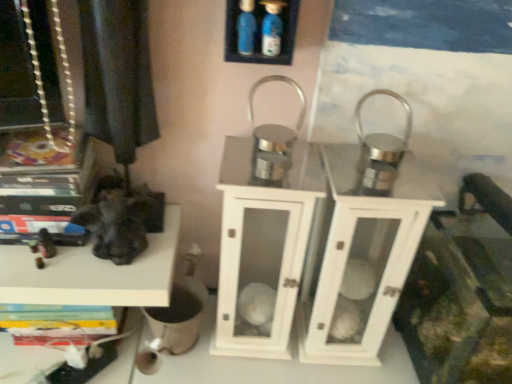
Question: Is white glossy lantern at center with black matte statue at left, which ranks as the second shelf in front-to-back order?

Choices:
 (A) yes
 (B) no

Answer: (B)

Question: From a real-world perspective, is white glossy lantern at center positioned over black matte statue at left, which is the first shelf from bottom to top, based on gravity?

Choices:
 (A) no
 (B) yes

Answer: (B)

Question: Does white glossy lantern at center come behind black matte statue at left, which ranks as the second shelf in top-to-bottom order?

Choices:
 (A) yes
 (B) no

Answer: (B)

Question: From the image's perspective, is white glossy lantern at center under black matte statue at left, which ranks as the second shelf in top-to-bottom order?

Choices:
 (A) yes
 (B) no

Answer: (B)

Question: Considering the relative sizes of white glossy lantern at center and black matte statue at left, the first shelf when ordered from left to right, in the image provided, is white glossy lantern at center thinner than black matte statue at left, the first shelf when ordered from left to right,?

Choices:
 (A) yes
 (B) no

Answer: (A)

Question: Would you say black matte statue at left, which ranks as the second shelf in front-to-back order, is to the left or to the right of blue plastic bottles at upper center, which is the first shelf from top to bottom, in the picture?

Choices:
 (A) right
 (B) left

Answer: (B)

Question: Is point (173, 230) positioned closer to the camera than point (282, 19)?

Choices:
 (A) closer
 (B) farther

Answer: (B)

Question: From the image's perspective, is black matte statue at left, which ranks as the second shelf in front-to-back order, above or below blue plastic bottles at upper center, the first shelf in the right-to-left sequence?

Choices:
 (A) above
 (B) below

Answer: (B)

Question: Looking at their shapes, would you say black matte statue at left, the first shelf when ordered from left to right, is wider or thinner than blue plastic bottles at upper center, the first shelf in the right-to-left sequence?

Choices:
 (A) thin
 (B) wide

Answer: (B)

Question: In terms of height, does blue plastic bottles at upper center, the second shelf when ordered from back to front, look taller or shorter compared to black matte statue at left, which ranks as the second shelf in top-to-bottom order?

Choices:
 (A) tall
 (B) short

Answer: (A)

Question: From a real-world perspective, is blue plastic bottles at upper center, which is the 2th shelf in bottom-to-top order, positioned above or below black matte statue at left, the first shelf when ordered from left to right?

Choices:
 (A) above
 (B) below

Answer: (A)

Question: Looking at the image, does blue plastic bottles at upper center, the second shelf when ordered from back to front, seem bigger or smaller compared to black matte statue at left, which ranks as the second shelf in top-to-bottom order?

Choices:
 (A) big
 (B) small

Answer: (B)

Question: From the image's perspective, is blue plastic bottles at upper center, the second shelf when ordered from back to front, above or below black matte statue at left, which ranks as the second shelf in top-to-bottom order?

Choices:
 (A) below
 (B) above

Answer: (B)

Question: From a real-world perspective, relative to black matte statue at left, which is the first shelf in back-to-front order, is white glossy lantern at center vertically above or below?

Choices:
 (A) above
 (B) below

Answer: (A)

Question: Relative to black matte statue at left, which is the first shelf from bottom to top, is white glossy lantern at center in front or behind?

Choices:
 (A) behind
 (B) front

Answer: (B)